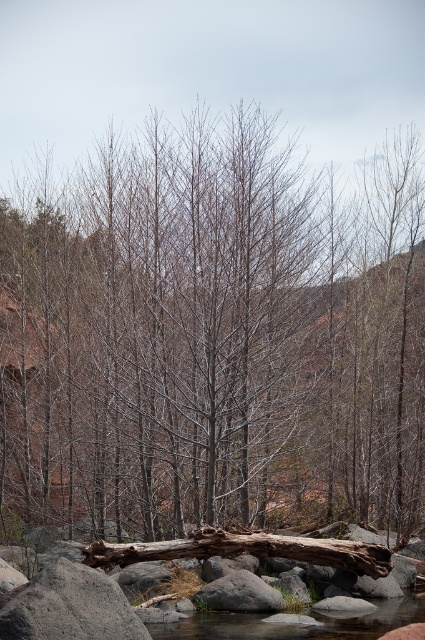
You are a photographer standing in the scene and want to take a photo of both point (x=416, y=292) and point (x=257, y=547). Which point is closer to your camera?

Point (x=257, y=547) is closer to the camera because it is less further than point (x=416, y=292).